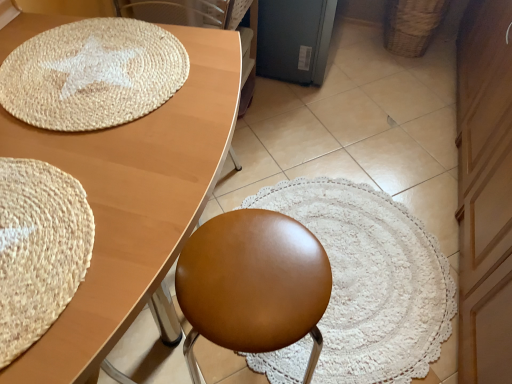
Identify the location of vacant space that is in between satin brown stool at center and woven brown basket at upper right. (359, 145).